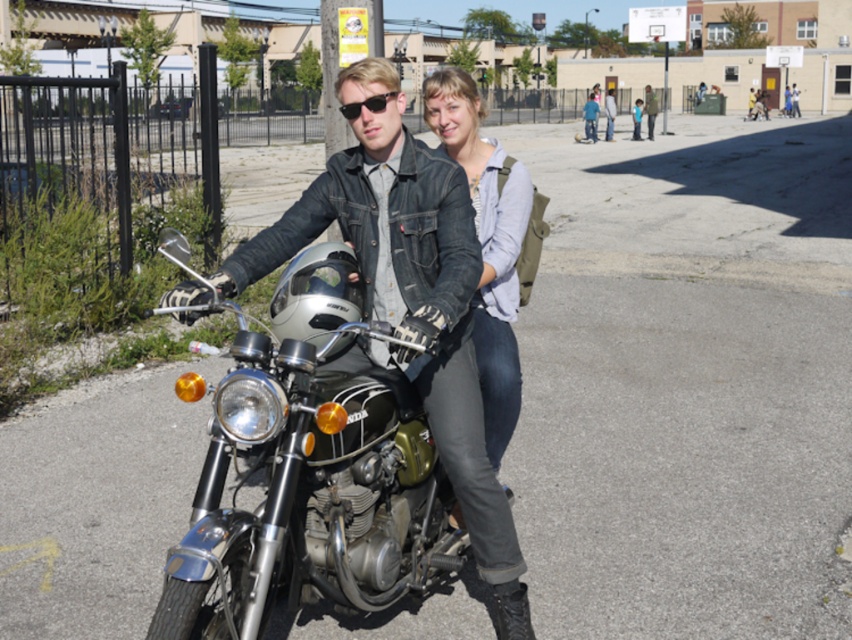
Can you confirm if shiny chrome motorcycle at center is positioned above black matte sunglasses at center?

Actually, shiny chrome motorcycle at center is below black matte sunglasses at center.

Is the position of shiny chrome motorcycle at center less distant than that of black matte sunglasses at center?

Yes, it is in front of black matte sunglasses at center.

Does point (309, 529) come farther from viewer compared to point (346, 106)?

That is False.

At what (x,y) coordinates should I click in order to perform the action: click on shiny chrome motorcycle at center. Please return your answer as a coordinate pair (x, y). The image size is (852, 640). Looking at the image, I should click on (309, 472).

Is denim jacket at center positioned before black matte sunglasses at center?

No, denim jacket at center is further to the viewer.

Does denim jacket at center have a greater width compared to black matte sunglasses at center?

Correct, the width of denim jacket at center exceeds that of black matte sunglasses at center.

Which is behind, point (470, 154) or point (378, 109)?

The point (470, 154) is more distant.

Where is `denim jacket at center`? The width and height of the screenshot is (852, 640). denim jacket at center is located at coordinates (486, 244).

Does shiny chrome motorcycle at center appear on the right side of denim jacket at center?

Incorrect, shiny chrome motorcycle at center is not on the right side of denim jacket at center.

Which is more to the right, shiny chrome motorcycle at center or denim jacket at center?

denim jacket at center is more to the right.

Find the location of a particular element. shiny chrome motorcycle at center is located at coordinates coord(309,472).